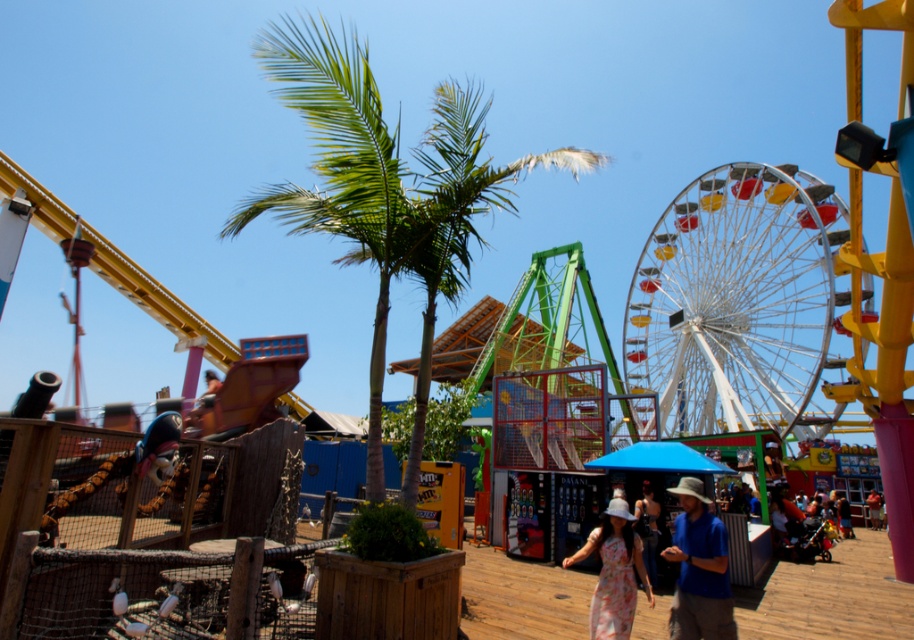
Question: Does blue cotton shirt at center come in front of floral fabric dress at center?

Choices:
 (A) no
 (B) yes

Answer: (B)

Question: Which of the following is the closest to the observer?

Choices:
 (A) (609, 627)
 (B) (367, 74)
 (C) (664, 548)

Answer: (A)

Question: Among these points, which one is nearest to the camera?

Choices:
 (A) (705, 602)
 (B) (336, 152)
 (C) (874, 493)
 (D) (597, 582)

Answer: (A)

Question: Which is farther from the metallic ferris wheel at right?

Choices:
 (A) floral fabric dress at center
 (B) blue cotton shirt at center
 (C) green leafy palm tree at center
 (D) blue denim shorts at center

Answer: (A)

Question: Does metallic ferris wheel at right lie behind green leafy palm tree at center?

Choices:
 (A) yes
 (B) no

Answer: (A)

Question: Is floral fabric dress at center above blue denim shorts at center?

Choices:
 (A) no
 (B) yes

Answer: (B)